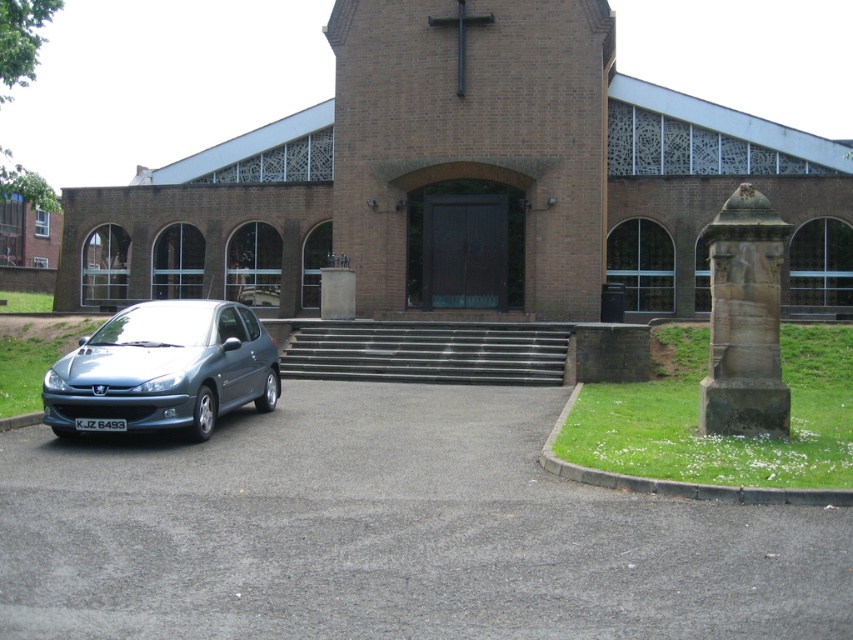
Who is positioned more to the right, brick church at center or satin metallic car at lower left?

From the viewer's perspective, brick church at center appears more on the right side.

Is point (627, 120) positioned after point (180, 352)?

Yes, point (627, 120) is farther from viewer.

Where is `brick church at center`? This screenshot has height=640, width=853. brick church at center is located at coordinates 462,179.